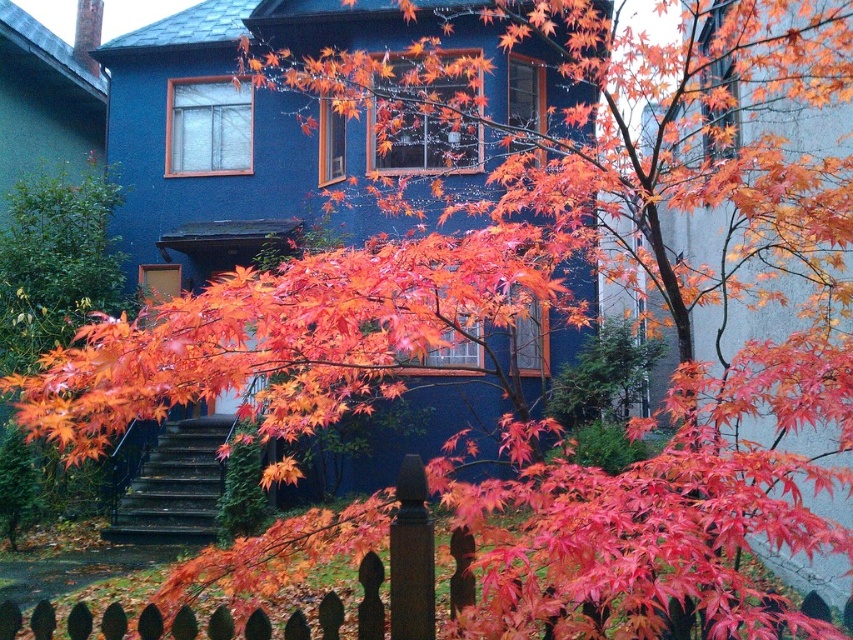
You are standing in front of the house with the vivid orange maple leaf at center in your view. You want to pick up this leaf without moving your feet. Is the leaf within your reach?

The vivid orange maple leaf at center is 2.56 meters from the camera, which is beyond typical human arm reach. Therefore, you cannot pick it up without moving your feet.

You are standing in front of the house and notice a vivid orange maple leaf at center and a wooden picket fence at lower center. Which object is located to the right of the other?

The vivid orange maple leaf at center is positioned on the right side of wooden picket fence at lower center.

You are standing in front of the house and notice both the vivid orange maple leaf at center and the wooden picket fence at lower center. Which object appears taller in the scene?

The vivid orange maple leaf at center appears taller than the wooden picket fence at lower center.